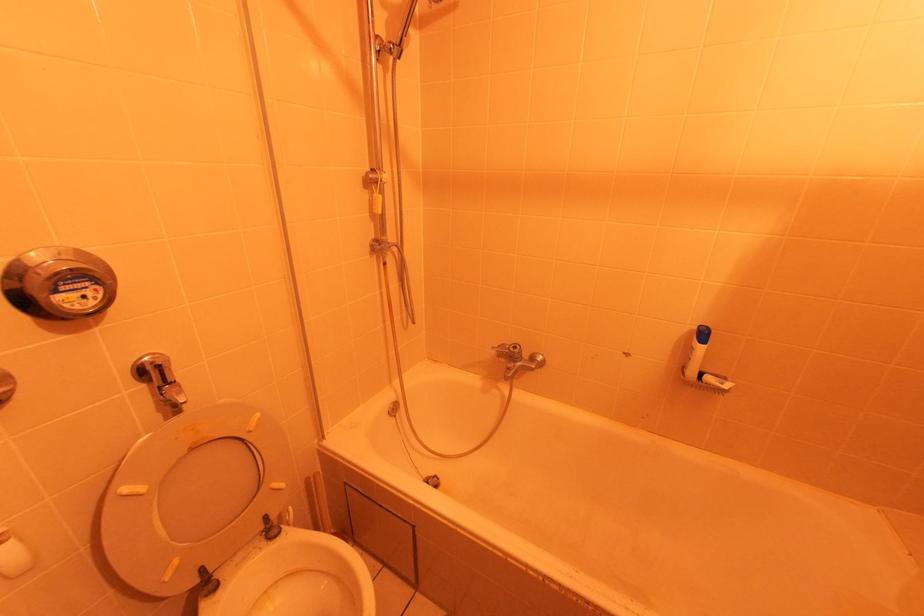
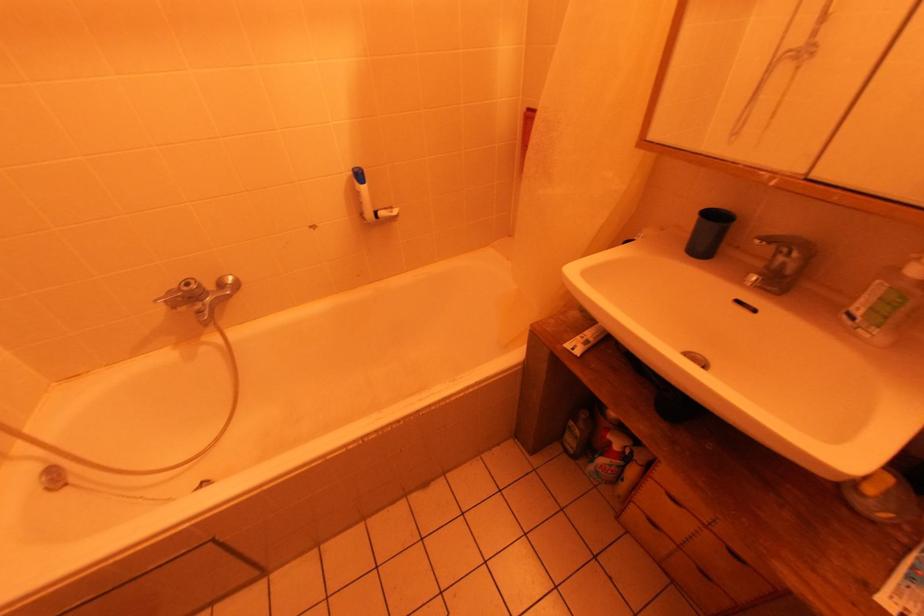
How did the camera likely rotate?

The rotation direction of the camera is right-down.